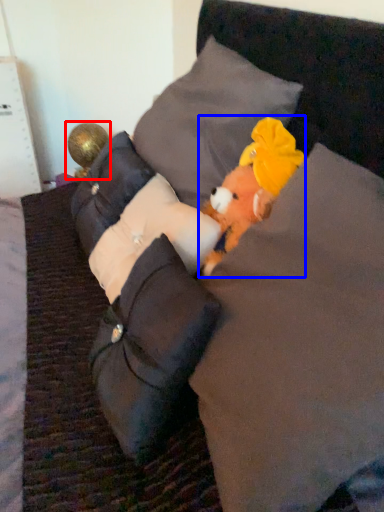
Question: Which of the following is the farthest to the observer, toy (highlighted by a red box) or toy (highlighted by a blue box)?

Choices:
 (A) toy
 (B) toy

Answer: (A)